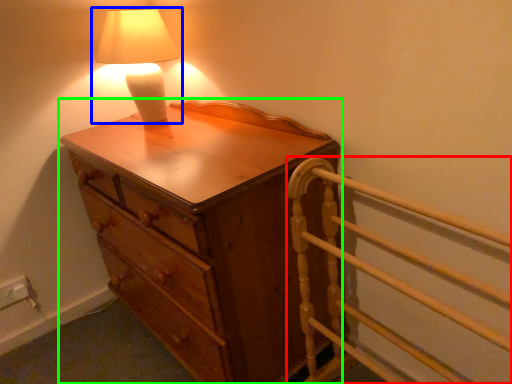
Question: Estimate the real-world distances between objects in this image. Which object is farther from bed frame (highlighted by a red box), lamp (highlighted by a blue box) or chest of drawers (highlighted by a green box)?

Choices:
 (A) lamp
 (B) chest of drawers

Answer: (A)